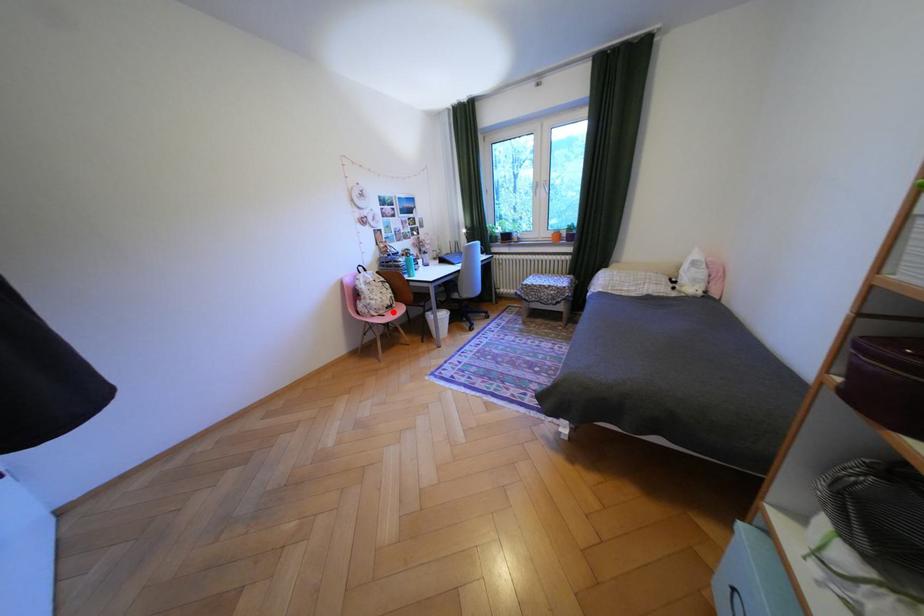
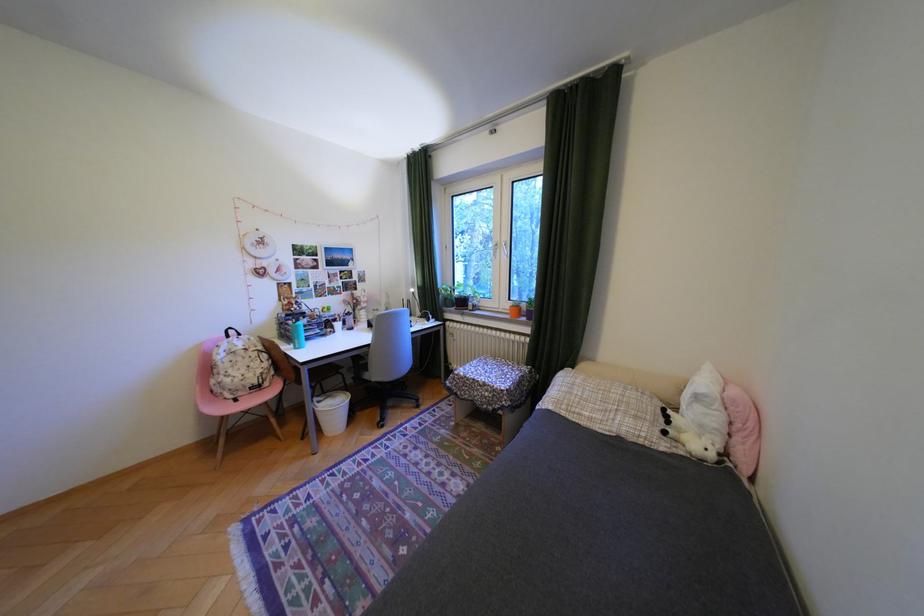
Find the pixel in the second image that matches the highlighted location in the first image.

(251, 394)